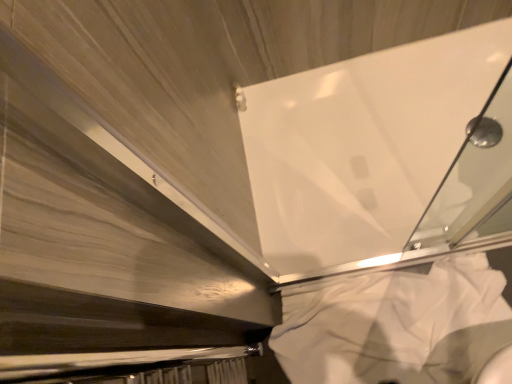
Question: Should I look upward or downward to see white fabric at lower right?

Choices:
 (A) up
 (B) down

Answer: (B)